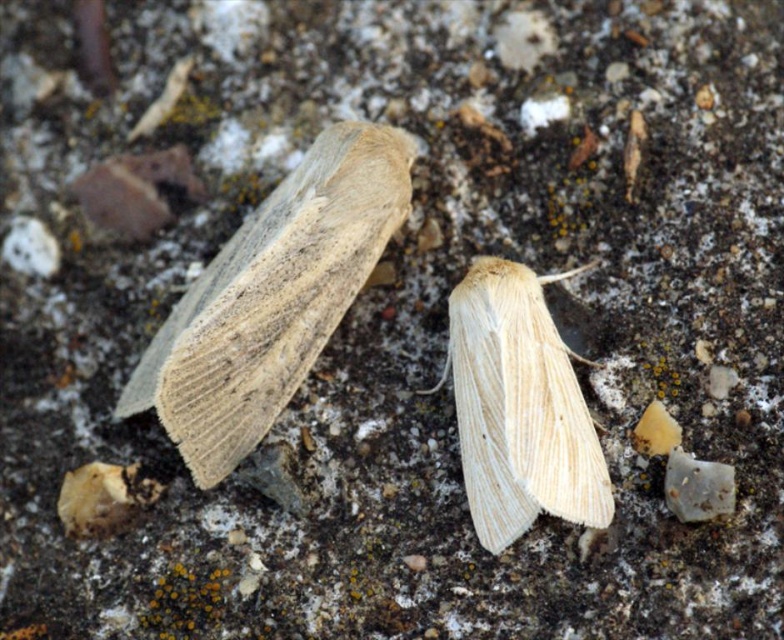
You are a photographer standing at the edge of the textured surface where the beige woolen moth at upper left is resting. You want to capture a closeup shot of the moth without disturbing it. If your camera lens can focus on objects as close as 1 meter away, will you be able to take the photo from your current position?

The beige woolen moth at upper left is 1.28 meters from the viewer. Since your camera lens can focus as close as 1 meter, you are within the required distance and can take the closeup shot without moving closer.

Consider the image. You are an entomologist observing two moths on a rocky surface. You need to determine their positions relative to each other. Which moth is closer to you, the beige woolen moth at upper left or the light beige wool moth at center?

The beige woolen moth at upper left is closer to you because it is positioned in front of the light beige wool moth at center.